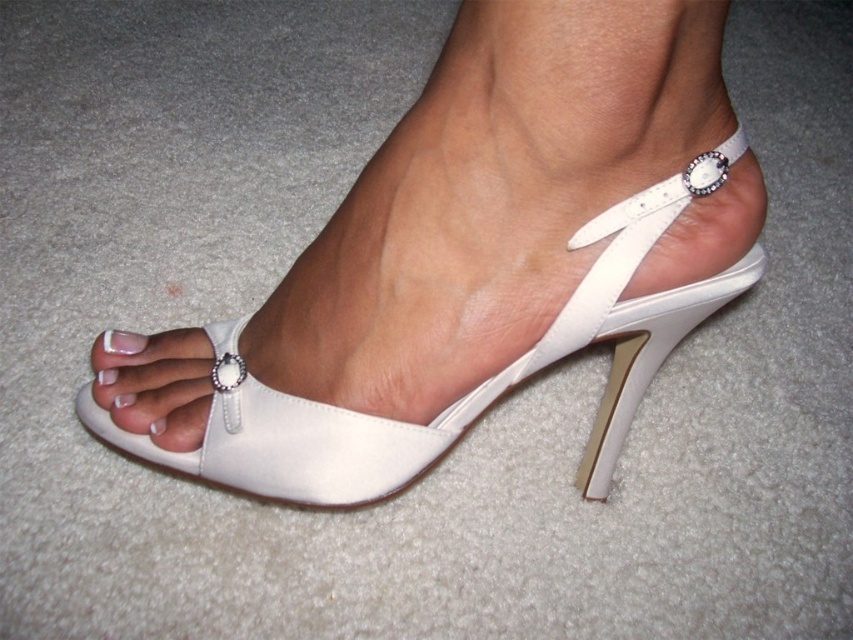
Can you confirm if white satin sandal at center is positioned to the right of white glossy nail at center?

Yes, white satin sandal at center is to the right of white glossy nail at center.

Does point (216, 403) come farther from viewer compared to point (129, 342)?

No.

Locate an element on the screen. This screenshot has width=853, height=640. white satin sandal at center is located at coordinates (471, 388).